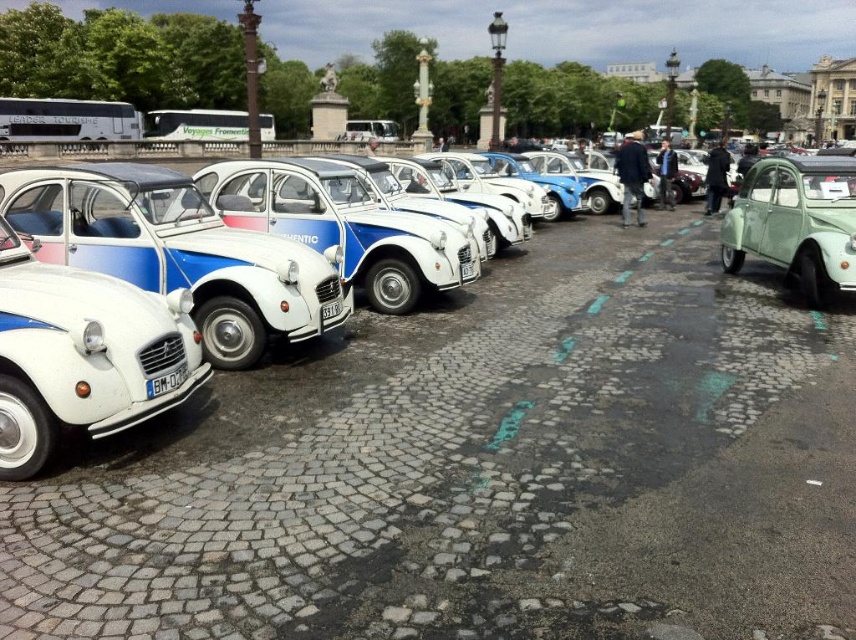
Is white matte vintage car at center below white matte car at center?

Indeed, white matte vintage car at center is positioned under white matte car at center.

Which is above, white matte vintage car at center or white matte car at center?

white matte car at center is above.

What do you see at coordinates (177, 252) in the screenshot? I see `white matte vintage car at center` at bounding box center [177, 252].

You are a GUI agent. You are given a task and a screenshot of the screen. Output one action in this format:
    pyautogui.click(x=<x>, y=<y>)
    Task: Click on the white matte vintage car at center
    The height and width of the screenshot is (640, 856).
    Given the screenshot: What is the action you would take?
    pyautogui.click(x=177, y=252)

Based on the photo, between white matte car at center and matte green car at right, which one is positioned lower?

matte green car at right is lower down.

Describe the element at coordinates (358, 353) in the screenshot. I see `white matte car at center` at that location.

I want to click on white matte car at center, so click(358, 353).

Between white matte vintage car at center and matte green car at right, which one is positioned lower?

Result: white matte vintage car at center is lower down.

How distant is white matte vintage car at center from matte green car at right?

white matte vintage car at center is 5.75 meters away from matte green car at right.

You are a GUI agent. You are given a task and a screenshot of the screen. Output one action in this format:
    pyautogui.click(x=<x>, y=<y>)
    Task: Click on the white matte vintage car at center
    
    Given the screenshot: What is the action you would take?
    pyautogui.click(x=177, y=252)

Identify the location of white matte vintage car at center. This screenshot has height=640, width=856. (177, 252).